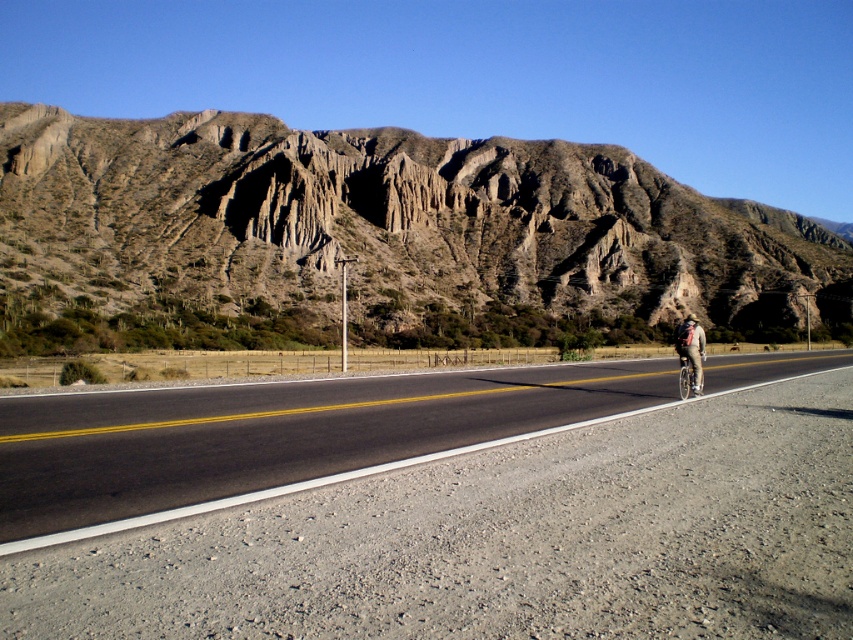
How much distance is there between rugged brown rock formation at upper center and black asphalt road at center?

rugged brown rock formation at upper center and black asphalt road at center are 461.23 feet apart.

The width and height of the screenshot is (853, 640). What do you see at coordinates (376, 240) in the screenshot?
I see `rugged brown rock formation at upper center` at bounding box center [376, 240].

Where is `rugged brown rock formation at upper center`? The image size is (853, 640). rugged brown rock formation at upper center is located at coordinates (376, 240).

Is black asphalt road at center to the left of matte black helmet at center from the viewer's perspective?

Correct, you'll find black asphalt road at center to the left of matte black helmet at center.

Measure the distance between point (213,456) and camera.

28.51 feet

At what (x,y) coordinates should I click in order to perform the action: click on black asphalt road at center. Please return your answer as a coordinate pair (x, y). The width and height of the screenshot is (853, 640). Looking at the image, I should click on (277, 435).

Describe the element at coordinates (376, 240) in the screenshot. This screenshot has width=853, height=640. I see `rugged brown rock formation at upper center` at that location.

Who is more forward, (90, 246) or (688, 316)?

Point (90, 246)

What are the coordinates of `rugged brown rock formation at upper center` in the screenshot? It's located at (376, 240).

The image size is (853, 640). What are the coordinates of `rugged brown rock formation at upper center` in the screenshot? It's located at (376, 240).